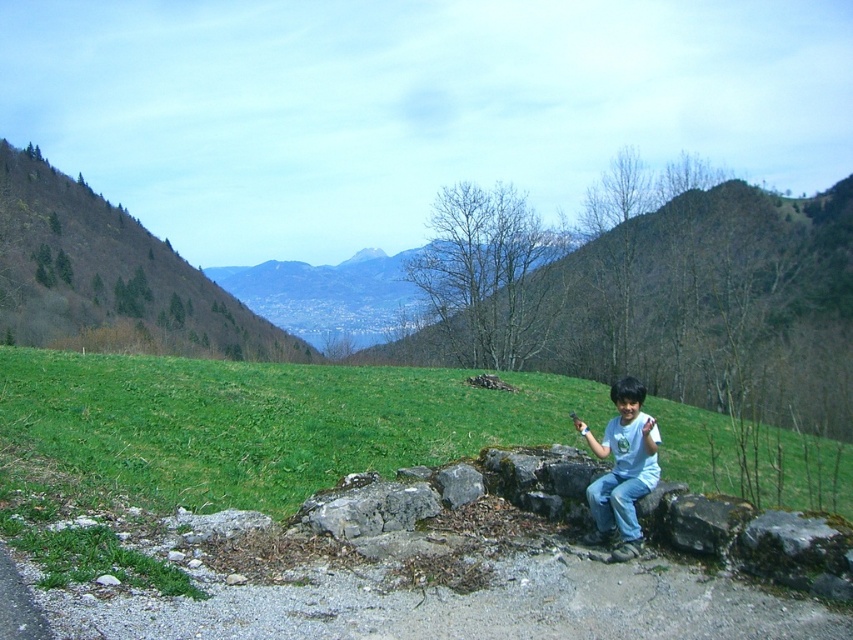
Is light blue cotton shirt at center smaller than blue denim jeans at lower center?

No, light blue cotton shirt at center is not smaller than blue denim jeans at lower center.

Is light blue cotton shirt at center positioned at the back of blue denim jeans at lower center?

No, it is not.

At what (x,y) coordinates should I click in order to perform the action: click on light blue cotton shirt at center. Please return your answer as a coordinate pair (x, y). This screenshot has height=640, width=853. Looking at the image, I should click on (622, 468).

This screenshot has width=853, height=640. Identify the location of light blue cotton shirt at center. (622, 468).

Which is below, green leafy hillside at upper left or light blue cotton shirt at center?

light blue cotton shirt at center

Can you confirm if green leafy hillside at upper left is positioned below light blue cotton shirt at center?

Incorrect, green leafy hillside at upper left is not positioned below light blue cotton shirt at center.

This screenshot has width=853, height=640. I want to click on green leafy hillside at upper left, so click(x=109, y=276).

Is green grassy hillside at center bigger than blue denim jeans at lower center?

Indeed, green grassy hillside at center has a larger size compared to blue denim jeans at lower center.

Based on the photo, is green grassy hillside at center thinner than blue denim jeans at lower center?

Incorrect, green grassy hillside at center's width is not less than blue denim jeans at lower center's.

Between point (258, 406) and point (635, 536), which one is positioned in front?

Point (635, 536)

Where is `green grassy hillside at center`? The height and width of the screenshot is (640, 853). green grassy hillside at center is located at coordinates (265, 420).